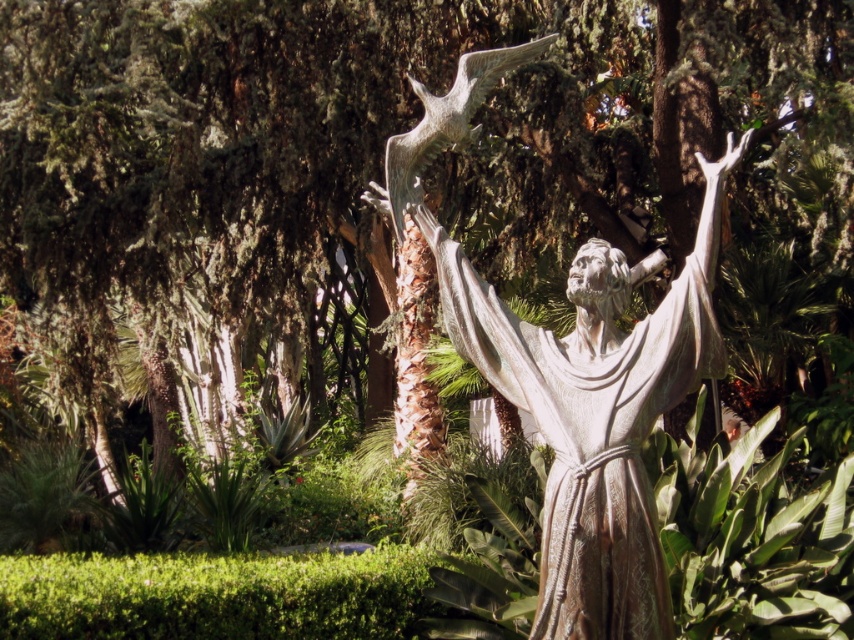
You are an ornithologist observing the bronze statue at center and the shiny silver bird at upper center in the image. Which object is positioned higher in the scene?

The shiny silver bird at upper center is positioned higher than the bronze statue at center.

You are a maintenance worker needing to clean the bronze statue at center and the shiny silver bird at upper center. You have a 1.2 meter long pole. Can you reach both objects with the pole from your current position?

The bronze statue at center is 1.05 meters away from the shiny silver bird at upper center. Since the pole is 1.2 meters long, you can reach both objects as the distance between them is less than the pole length.

You are a tour guide standing at a safe distance from the bronze statue at center. The safety regulations state that visitors must stay at least 6 meters away from the statue to prevent damage. Are you compliant with the regulations?

The bronze statue at center and viewer are 6.57 meters apart from each other, which exceeds the required 6 meters distance. Therefore, you are compliant with the safety regulations.